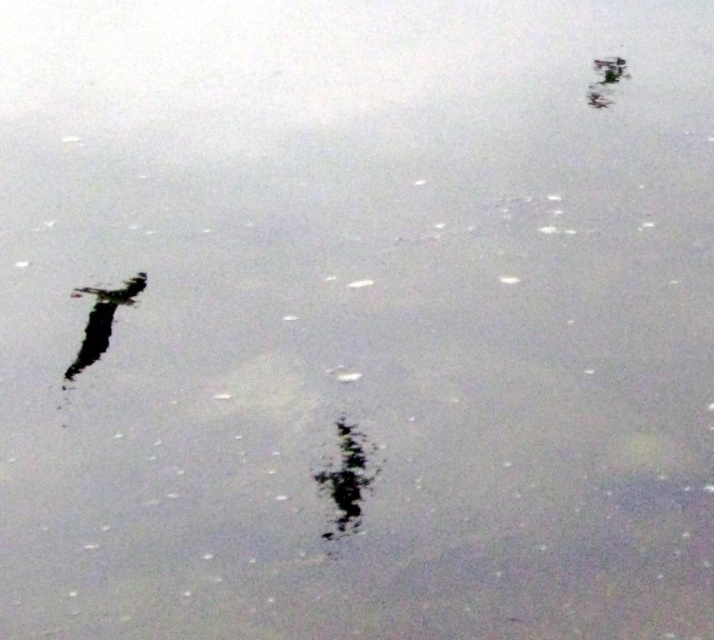
Is point (341, 532) farther from viewer compared to point (111, 301)?

No, it is in front of (111, 301).

Who is taller, black matte tree at center or silky black feather at left?

silky black feather at left

Which is in front, point (353, 506) or point (79, 371)?

Point (353, 506)

At what (x,y) coordinates should I click in order to perform the action: click on black matte tree at center. Please return your answer as a coordinate pair (x, y). The image size is (714, 640). Looking at the image, I should click on (346, 477).